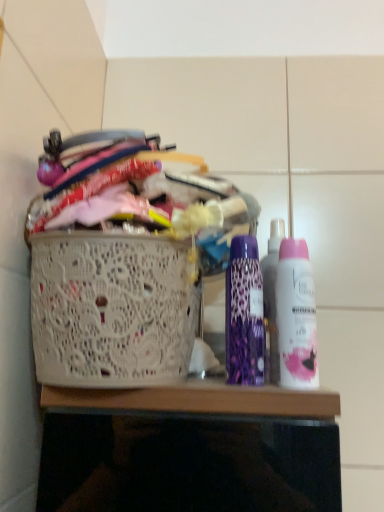
Question: From the image's perspective, relative to white lace basket at left, is pink matte deodorant at right, the 2th bottle in the left-to-right sequence, above or below?

Choices:
 (A) above
 (B) below

Answer: (A)

Question: From a real-world perspective, is pink matte deodorant at right, the 2th bottle in the left-to-right sequence, above or below white lace basket at left?

Choices:
 (A) above
 (B) below

Answer: (A)

Question: Considering the real-world distances, which object is farthest from the pink matte deodorant at right, the 2th bottle in the left-to-right sequence?

Choices:
 (A) purple leopard print deodorant at center, the second bottle in the right-to-left sequence
 (B) white lace basket at left

Answer: (B)

Question: Estimate the real-world distances between objects in this image. Which object is farther from the purple leopard print deodorant at center, the second bottle in the right-to-left sequence?

Choices:
 (A) white lace basket at left
 (B) pink matte deodorant at right, the 2th bottle in the left-to-right sequence

Answer: (A)